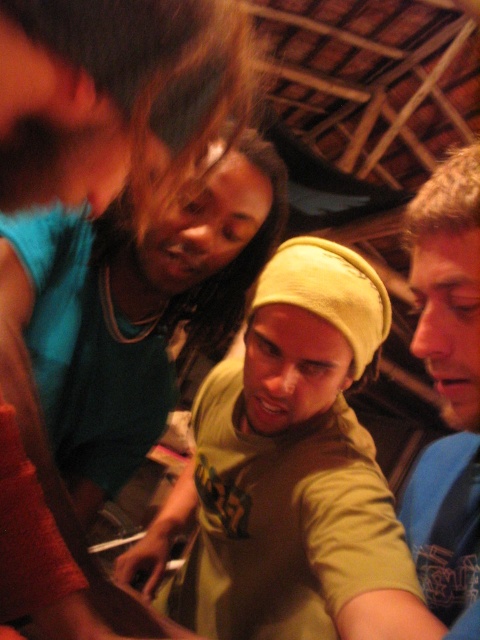
Looking at this image, you are standing at the entrance of the venue and want to hand a gift to the person wearing the light green knit cap at center. The gift is 10 centimeters in length. Is there enough space between you and the person to safely place the gift without touching others?

The distance between you and the person wearing the light green knit cap at center is 52.07 centimeters. Since the gift is only 10 centimeters long, there is sufficient space to place it safely without touching others.

You are standing in the room and want to place a small decoration exactly at the center of the room. The light green knit cap at center is currently at point 0.717, 0.615. Is the cap positioned at the exact center of the room?

The light green knit cap at center is located at point (295, 458), which is not the exact center of the room. The exact center would be at coordinates (240, 320), so the cap is offset to the right and slightly above the center point.

You are at a social gathering and want to hand a drink to the person wearing the blue cotton shirt at right. Since they are behind the light green knit cap at center, how can you reach them?

The blue cotton shirt at right is behind the light green knit cap at center, so you would need to move around or between the light green knit cap at center to reach the blue cotton shirt at right.